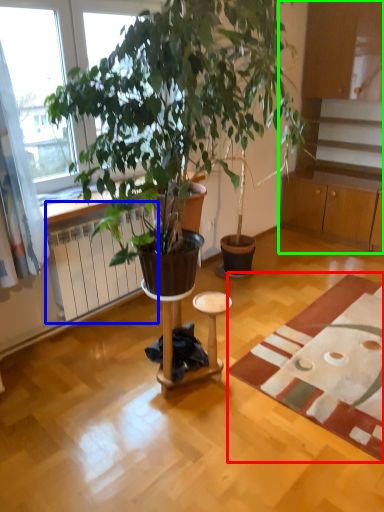
Question: Estimate the real-world distances between objects in this image. Which object is farther from mat (highlighted by a red box), radiator (highlighted by a blue box) or cabinetry (highlighted by a green box)?

Choices:
 (A) radiator
 (B) cabinetry

Answer: (B)